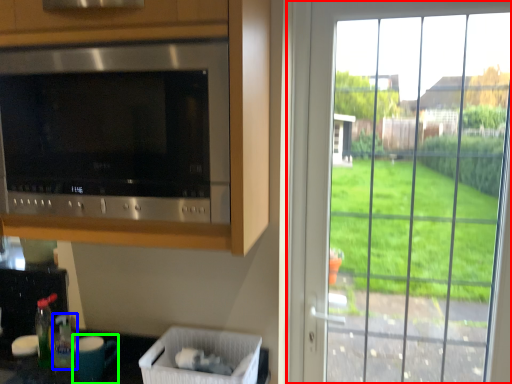
Question: Based on their relative distances, which object is nearer to window (highlighted by a red box)? Choose from bottle (highlighted by a blue box) and appliance (highlighted by a green box).

Choices:
 (A) bottle
 (B) appliance

Answer: (B)